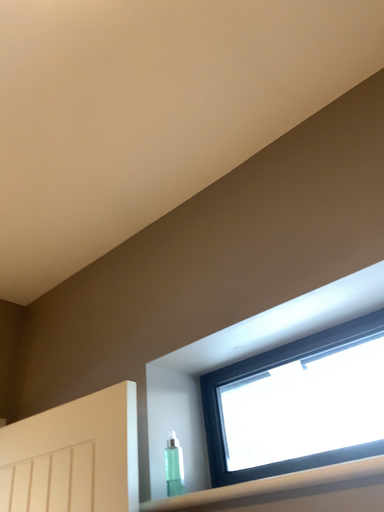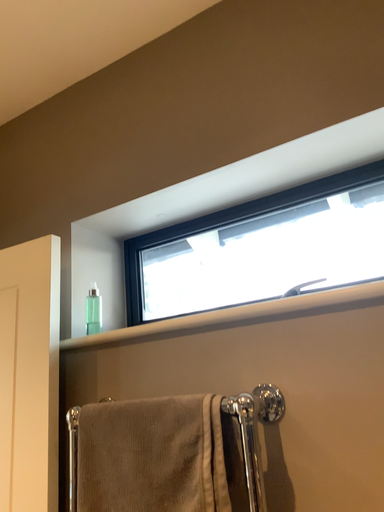
Question: Which way did the camera rotate in the video?

Choices:
 (A) rotated upward
 (B) rotated downward

Answer: (B)